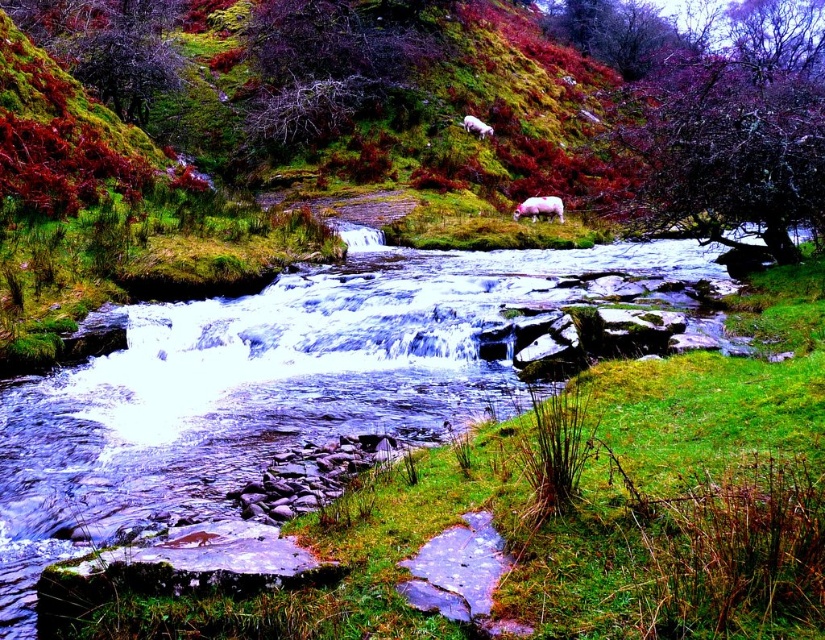
Is dark purple textured branch at upper center to the right of white woolly sheep at upper center from the viewer's perspective?

Incorrect, dark purple textured branch at upper center is not on the right side of white woolly sheep at upper center.

Which of these two, dark purple textured branch at upper center or white woolly sheep at upper center, stands taller?

dark purple textured branch at upper center is taller.

Is point (330, 140) positioned behind point (482, 132)?

That is False.

I want to click on dark purple textured branch at upper center, so click(323, 68).

Between point (766, 182) and point (479, 128), which one is positioned in front?

Point (766, 182)

Is purple leafy tree at upper right below white woolly sheep at upper center?

No.

Does point (661, 220) come behind point (472, 122)?

No, (661, 220) is closer to viewer.

Locate an element on the screen. purple leafy tree at upper right is located at coordinates (734, 124).

Does green grass at center have a greater width compared to dark purple textured branch at upper center?

No.

You are a GUI agent. You are given a task and a screenshot of the screen. Output one action in this format:
    pyautogui.click(x=<x>, y=<y>)
    Task: Click on the green grass at center
    
    Given the screenshot: What is the action you would take?
    pyautogui.click(x=667, y=483)